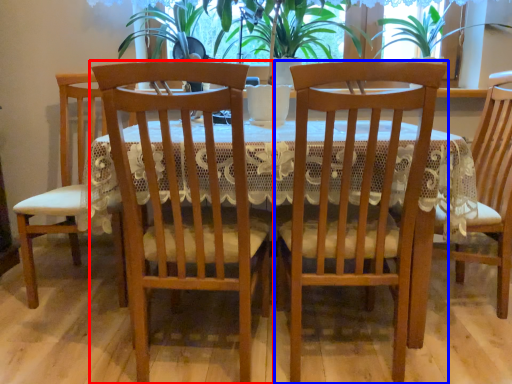
Question: Which point is closer to the camera, chair (highlighted by a red box) or chair (highlighted by a blue box)?

Choices:
 (A) chair
 (B) chair

Answer: (A)